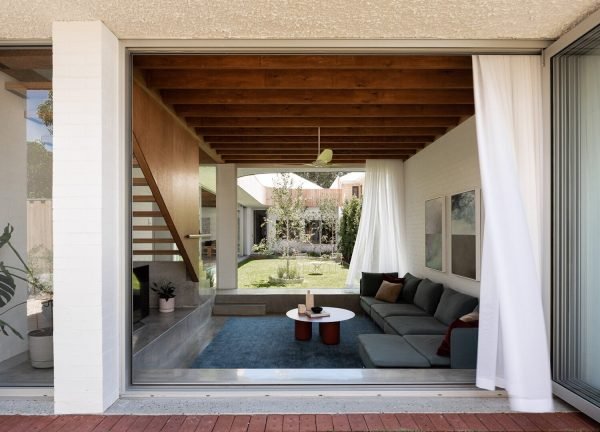
This screenshot has height=432, width=600. I want to click on staircase, so click(x=161, y=203).